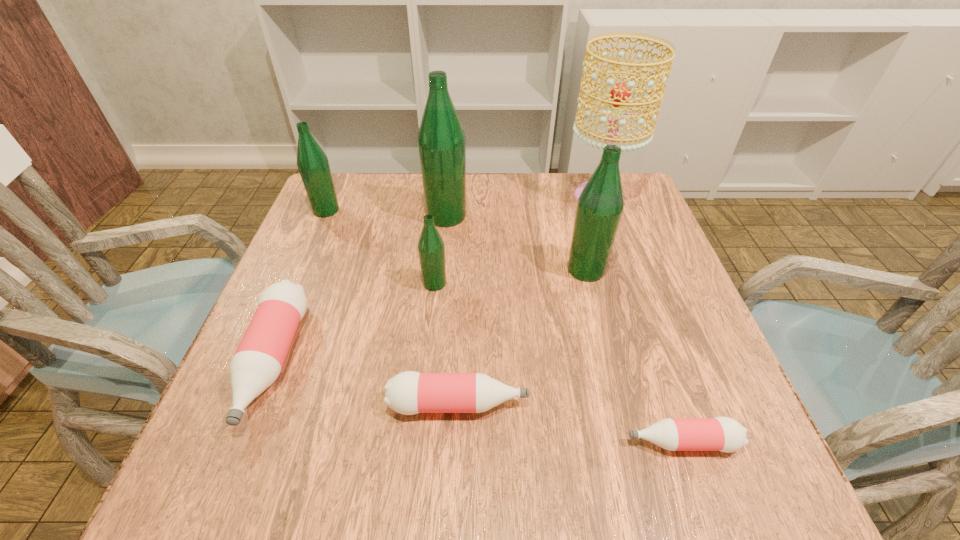
Choose which pink bottle is the second nearest neighbor to the smallest pink bottle. Please provide its 2D coordinates. Your answer should be formatted as a tuple, i.e. [(x, y)], where the tuple contains the x and y coordinates of a point satisfying the conditions above.

[(258, 360)]

This screenshot has width=960, height=540. I want to click on free point that satisfies the following two spatial constraints: 1. on the front side of the rightmost green bottle; 2. on the left side of the biggest green bottle, so click(442, 269).